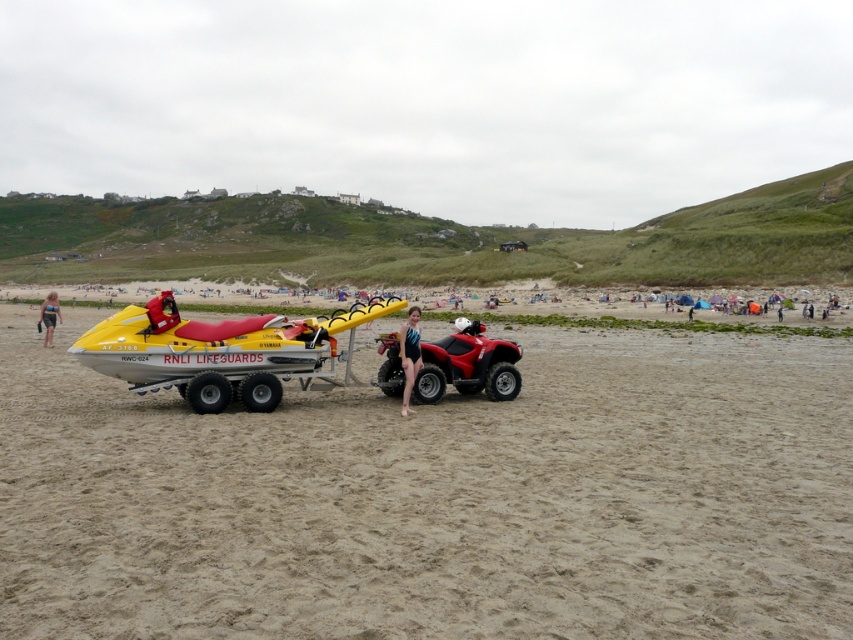
Question: Which object is positioned farthest from the yellow matte lifeboat at center?

Choices:
 (A) matte black swimsuit at left
 (B) blue swimsuit at center

Answer: (A)

Question: Does yellow matte lifeboat at center have a smaller size compared to matte red quad bike at center?

Choices:
 (A) no
 (B) yes

Answer: (A)

Question: Is the position of yellow matte lifeboat at center more distant than that of matte black swimsuit at left?

Choices:
 (A) yes
 (B) no

Answer: (B)

Question: Can you confirm if yellow matte lifeboat at center is smaller than matte red quad bike at center?

Choices:
 (A) yes
 (B) no

Answer: (B)

Question: Which object is positioned closest to the matte red quad bike at center?

Choices:
 (A) yellow matte lifeboat at center
 (B) sandy beige at center
 (C) blue swimsuit at center
 (D) matte black swimsuit at left

Answer: (C)

Question: Estimate the real-world distances between objects in this image. Which object is farther from the matte black swimsuit at left?

Choices:
 (A) sandy beige at center
 (B) matte red quad bike at center

Answer: (B)